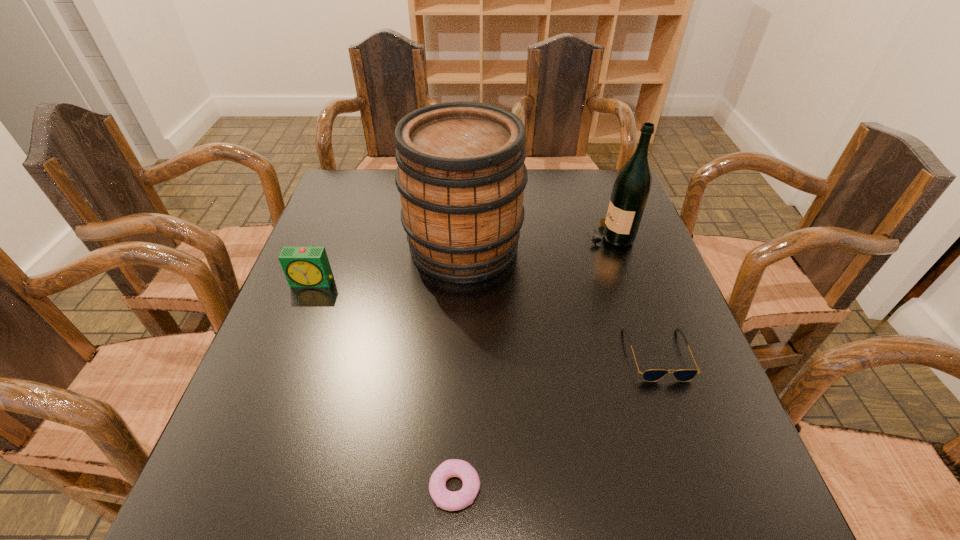
Locate an element on the screen. This screenshot has height=540, width=960. vacant region between the alarm clock and the cider is located at coordinates (389, 265).

Select which object is the fourth closest to the alarm clock. Please provide its 2D coordinates. Your answer should be formatted as a tuple, i.e. [(x, y)], where the tuple contains the x and y coordinates of a point satisfying the conditions above.

[(652, 375)]

What are the coordinates of `the closest object to the leftmost object` in the screenshot? It's located at (461, 175).

Find the location of a particular element. Image resolution: width=960 pixels, height=540 pixels. free location that satisfies the following two spatial constraints: 1. on the front-facing side of the shortest object; 2. on the right side of the alarm clock is located at coordinates (233, 488).